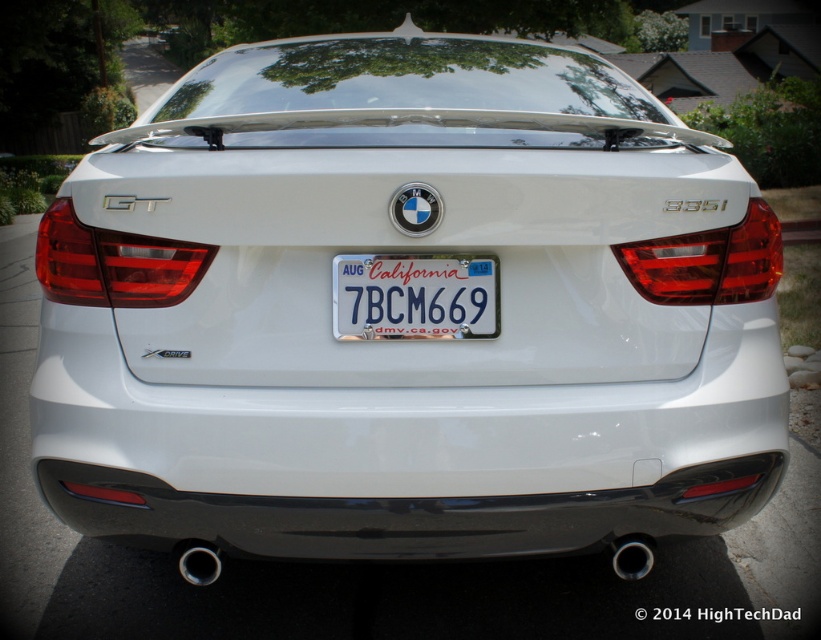
Does matte plastic tail light at center-left lie behind matte red tail light at right?

No, it is in front of matte red tail light at right.

Describe the element at coordinates (113, 262) in the screenshot. The height and width of the screenshot is (640, 821). I see `matte plastic tail light at center-left` at that location.

I want to click on matte plastic tail light at center-left, so point(113,262).

Which is behind, point (437, 284) or point (691, 276)?

The point (691, 276) is more distant.

Between point (360, 320) and point (741, 248), which one is positioned in front?

Point (360, 320)

Who is more forward, (392, 332) or (737, 289)?

A: Point (392, 332) is more forward.

Locate an element on the screen. This screenshot has height=640, width=821. white metallic license plate at center is located at coordinates [x=414, y=296].

Does point (363, 257) lie in front of point (113, 300)?

Yes.

Which is in front, point (338, 316) or point (70, 289)?

Point (338, 316) is more forward.

Between point (381, 266) and point (49, 209), which one is positioned behind?

Positioned behind is point (49, 209).

The width and height of the screenshot is (821, 640). Identify the location of white metallic license plate at center. (414, 296).